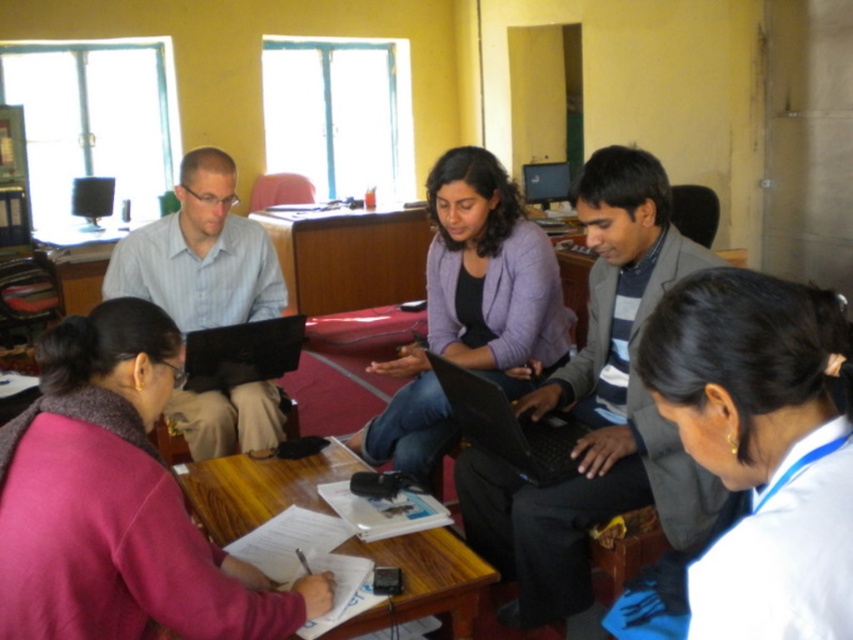
Question: Does striped knit sweater at center appear over purple matte sweater at center?

Choices:
 (A) yes
 (B) no

Answer: (B)

Question: Considering the real-world distances, which object is farthest from the white fabric at lower right?

Choices:
 (A) wooden table at lower center
 (B) pink fleece sweater at lower left
 (C) black glossy laptop at center
 (D) matte light blue shirt at upper left

Answer: (D)

Question: Can you confirm if wooden table at lower center is wider than black matte laptop at center?

Choices:
 (A) yes
 (B) no

Answer: (A)

Question: Among these objects, which one is nearest to the camera?

Choices:
 (A) striped knit sweater at center
 (B) black matte laptop at center
 (C) white fabric at lower right

Answer: (C)

Question: Which of the following is the farthest from the observer?

Choices:
 (A) black glossy laptop at center
 (B) white fabric at lower right

Answer: (A)

Question: From the image, what is the correct spatial relationship of white fabric at lower right in relation to wooden table at lower center?

Choices:
 (A) left
 (B) right

Answer: (B)